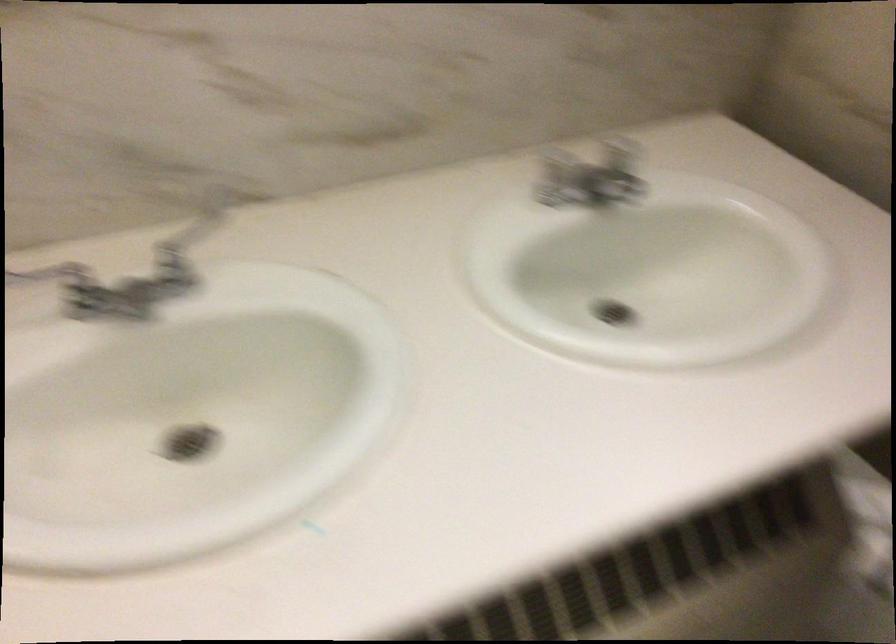
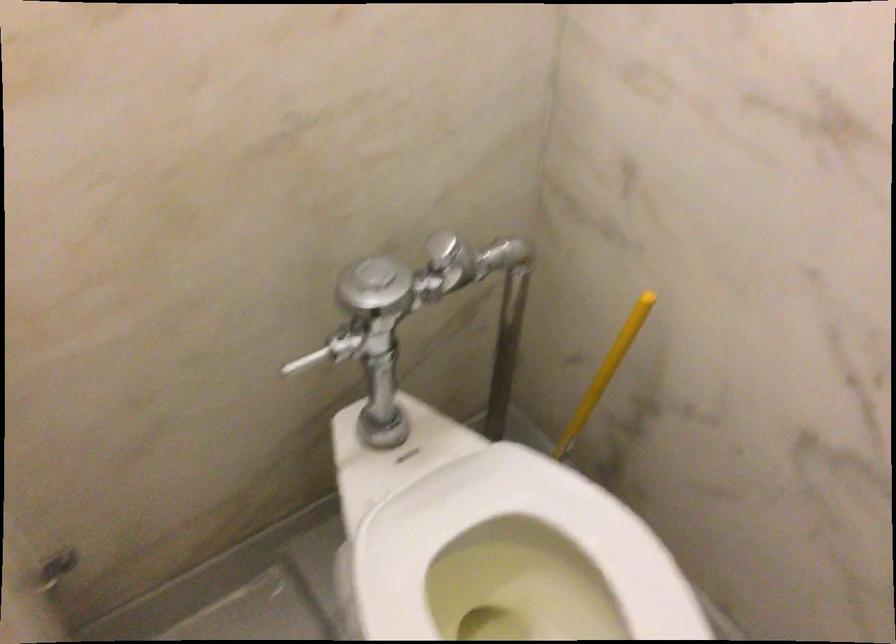
Consider the image. The images are taken continuously from a first-person perspective. In which direction are you moving?

The cameraman walked toward right, forward.